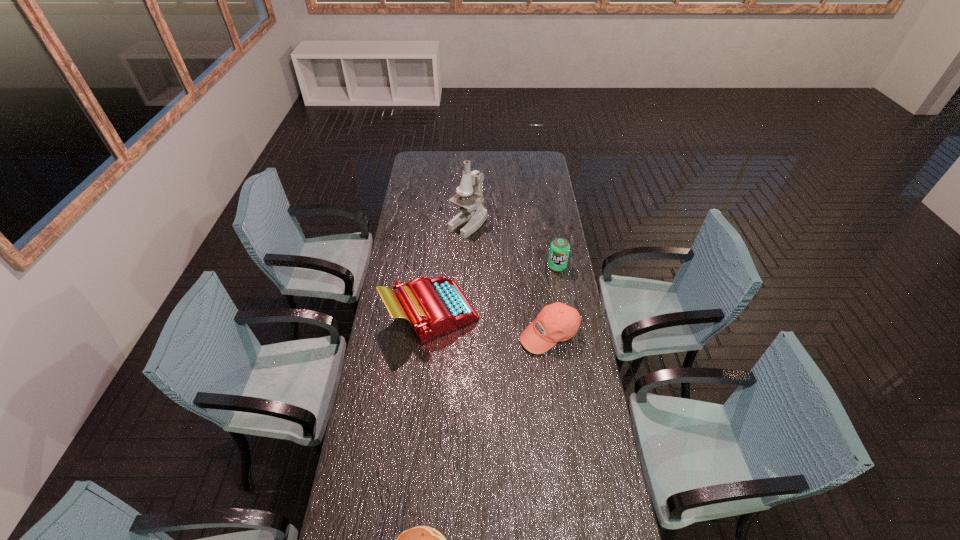
Find the location of a particular element. This screenshot has width=960, height=540. the tallest object is located at coordinates (473, 213).

Identify the location of microscope. (473, 213).

Locate an element on the screen. This screenshot has height=540, width=960. typewriter is located at coordinates (433, 307).

Identify the location of the second farthest object. This screenshot has width=960, height=540. (559, 250).

In order to click on baseball cap in this screenshot , I will do `click(556, 322)`.

Find the location of `vacant space located on the front of the tallest object`. vacant space located on the front of the tallest object is located at coordinates (467, 273).

At what (x,y) coordinates should I click in order to perform the action: click on vacant point located 0.300m on the typing side of the second tallest object. Please return your answer as a coordinate pair (x, y). The image size is (960, 540). Looking at the image, I should click on (548, 314).

The height and width of the screenshot is (540, 960). Identify the location of vacant area situated on the front-facing side of the pop soda. (564, 303).

The image size is (960, 540). I want to click on vacant space located 0.110m on the back of the baseball cap, so click(544, 294).

At what (x,y) coordinates should I click in order to perform the action: click on object located in the left edge section of the desktop. Please return your answer as a coordinate pair (x, y). This screenshot has height=540, width=960. Looking at the image, I should click on (433, 307).